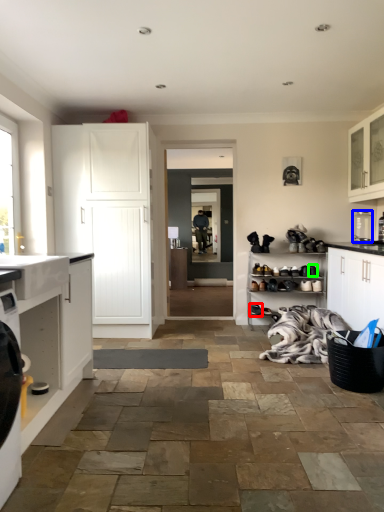
Question: Based on their relative distances, which object is nearer to footwear (highlighted by a red box)? Choose from appliance (highlighted by a blue box) and shoe (highlighted by a green box).

Choices:
 (A) appliance
 (B) shoe

Answer: (B)